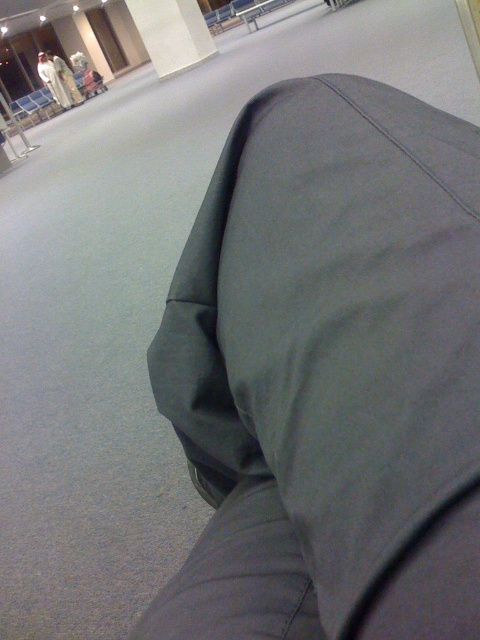
You are packing a suitcase and need to decide whether to place the light beige fabric coat at upper left and the white cotton robe at upper left inside. Given that the suitcase has a maximum capacity of 20 liters, can you determine if both items will fit together?

The light beige fabric coat at upper left is larger in size than the white cotton robe at upper left. However, without specific volume measurements for each item, it is impossible to determine if both will fit within the 20 liter suitcase capacity.

Consider the image. You are standing in an airport terminal and need to reach your flight quickly. You see the gray fabric pants at lower right and the light beige fabric coat at upper left. Which direction should you move to get closer to both objects simultaneously?

To get closer to both the gray fabric pants at lower right and the light beige fabric coat at upper left simultaneously, you should move towards the middle area between them since they are 15.36 meters apart. Moving towards the center would reduce the distance to both objects.